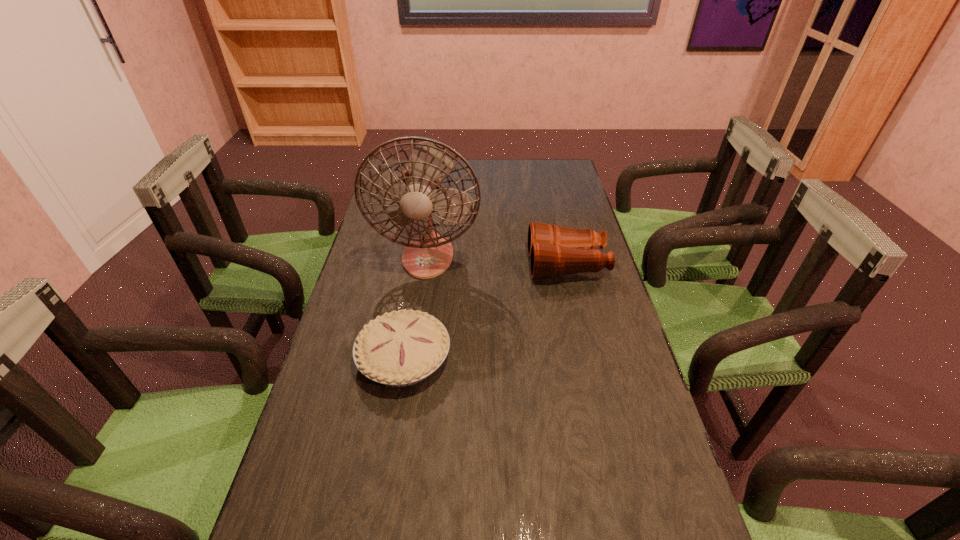
Image resolution: width=960 pixels, height=540 pixels. I want to click on fan that is at the left edge, so click(428, 254).

Find the location of a particular element. The width and height of the screenshot is (960, 540). pie that is at the left edge is located at coordinates (400, 348).

At what (x,y) coordinates should I click in order to perform the action: click on object present at the right edge. Please return your answer as a coordinate pair (x, y). Looking at the image, I should click on (554, 251).

The width and height of the screenshot is (960, 540). Find the location of `free space at the far edge of the desktop`. free space at the far edge of the desktop is located at coordinates (533, 180).

In the image, there is a desktop. Identify the location of vacant space at the left edge. (334, 373).

Locate an element on the screen. This screenshot has width=960, height=540. free space at the right edge is located at coordinates (560, 285).

Locate an element on the screen. The height and width of the screenshot is (540, 960). free point between the second shortest object and the tallest object is located at coordinates (497, 260).

This screenshot has width=960, height=540. What are the coordinates of `empty space that is in between the nearest object and the binoculars` in the screenshot? It's located at (486, 311).

This screenshot has width=960, height=540. I want to click on free spot between the fan and the nearest object, so click(x=416, y=307).

Locate an element on the screen. This screenshot has height=540, width=960. free space between the rightmost object and the fan is located at coordinates coord(497,260).